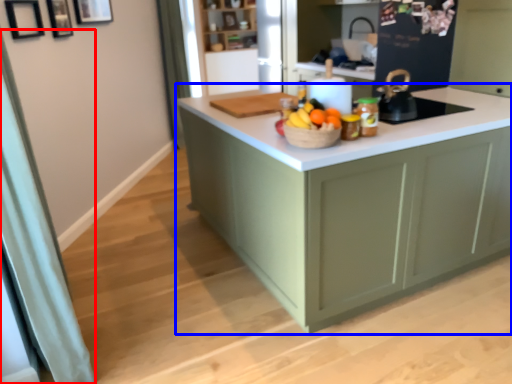
Question: Which object appears farthest to the camera in this image, curtain (highlighted by a red box) or cabinetry (highlighted by a blue box)?

Choices:
 (A) curtain
 (B) cabinetry

Answer: (B)